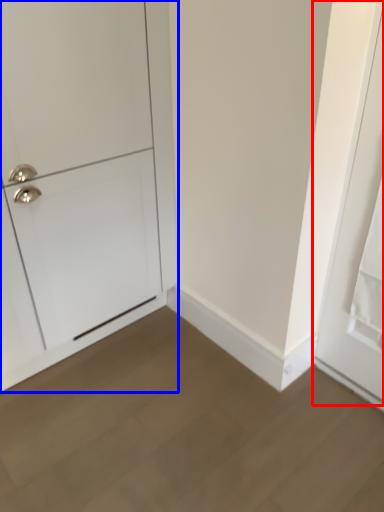
Question: Which of the following is the farthest to the observer, door (highlighted by a red box) or door (highlighted by a blue box)?

Choices:
 (A) door
 (B) door

Answer: (B)